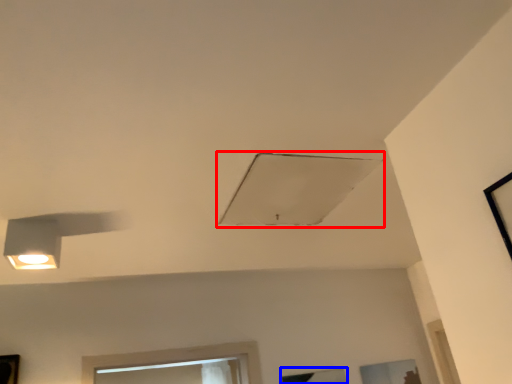
Question: Among these objects, which one is farthest to the camera, exhaust hood (highlighted by a red box) or window (highlighted by a blue box)?

Choices:
 (A) exhaust hood
 (B) window

Answer: (B)